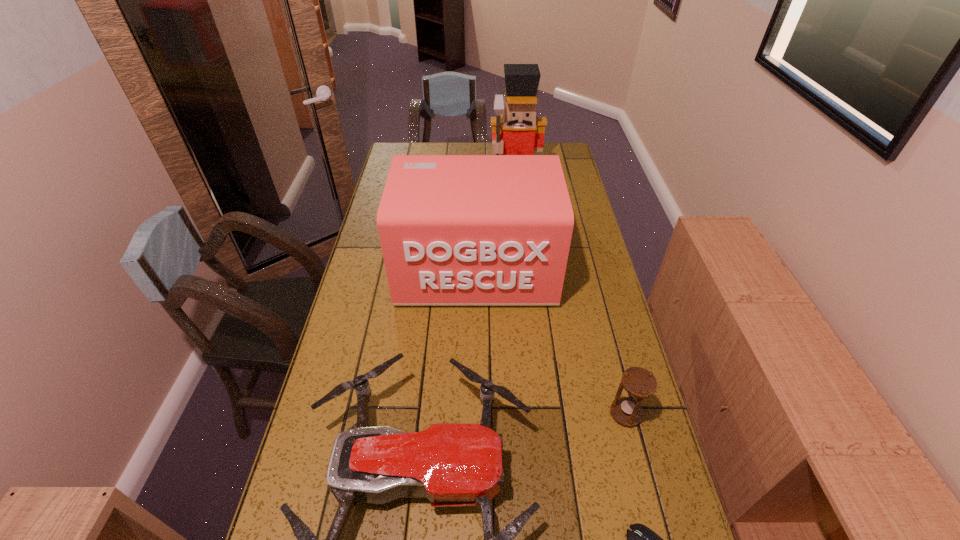
Where is `nutcracker`? The image size is (960, 540). nutcracker is located at coordinates (518, 131).

Image resolution: width=960 pixels, height=540 pixels. I want to click on the farthest object, so click(x=518, y=131).

Identify the location of box. (455, 230).

The image size is (960, 540). In order to click on the second farthest object in this screenshot , I will do `click(455, 230)`.

The width and height of the screenshot is (960, 540). I want to click on hourglass, so tap(639, 383).

You are a GUI agent. You are given a task and a screenshot of the screen. Output one action in this format:
    pyautogui.click(x=<x>, y=<y>)
    Task: Click on the free space located 0.070m in front of the nutcracker holding the staff
    Image resolution: width=960 pixels, height=540 pixels.
    Given the screenshot: What is the action you would take?
    pyautogui.click(x=517, y=205)

This screenshot has width=960, height=540. I want to click on vacant area located 0.090m on the surface of the second tallest object where the text is embossed, so click(x=476, y=334).

Identify the location of vacant region located 0.170m on the back of the hourglass. (609, 347).

This screenshot has height=540, width=960. Identify the location of object located at the left edge. (455, 230).

Where is `nutcracker at the right edge`? This screenshot has height=540, width=960. nutcracker at the right edge is located at coordinates (518, 131).